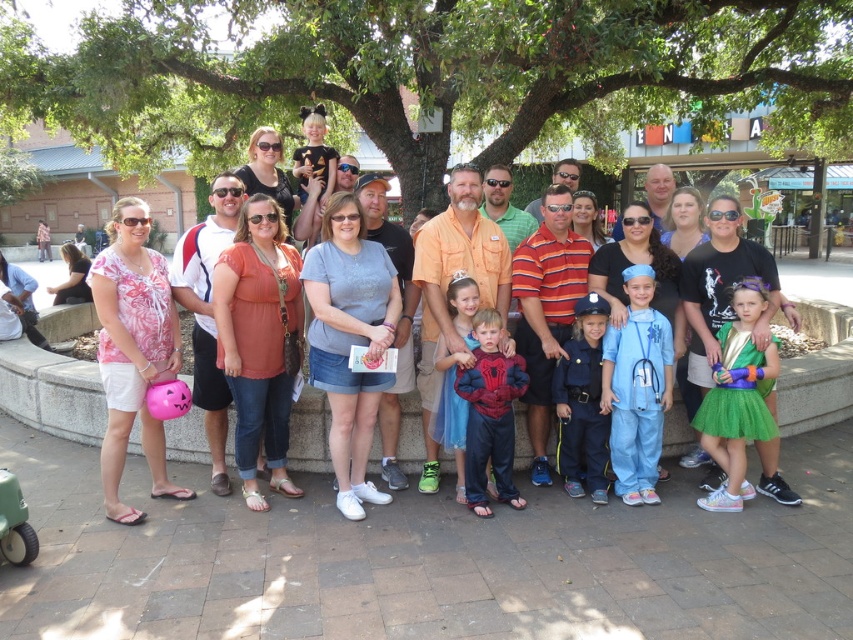
What are the coordinates of the striped polo shirt at center?

The striped polo shirt at center is located at point (546, 308).